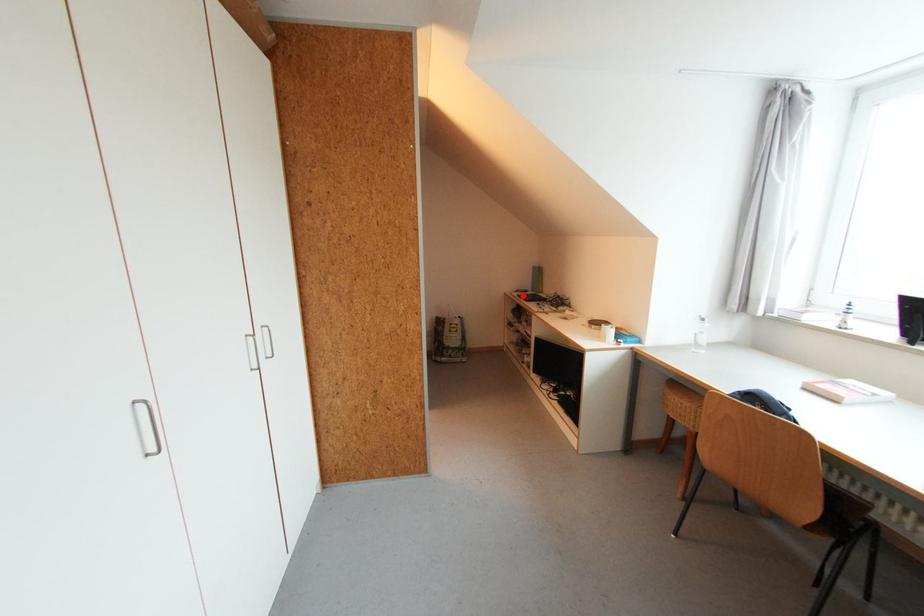
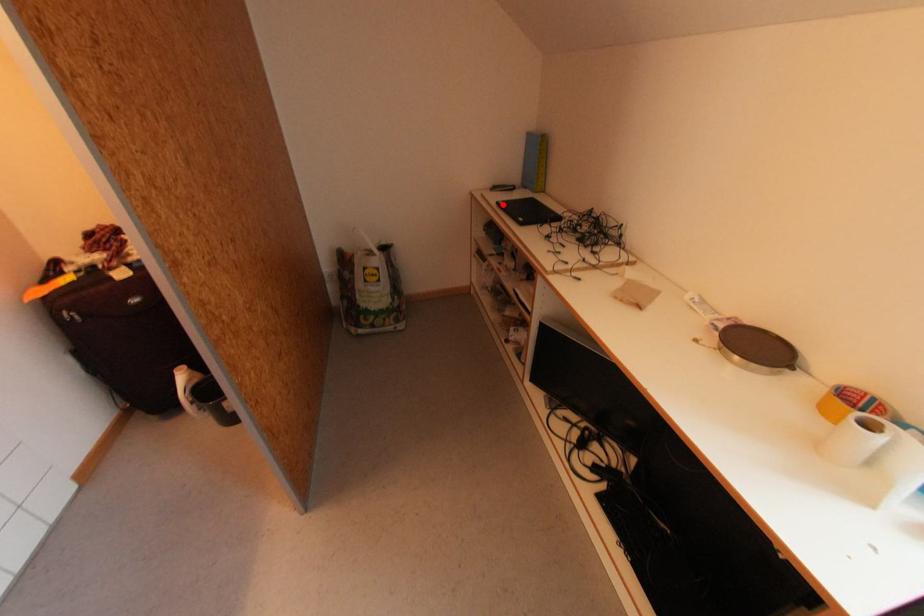
I am providing you with two images of the same scene from different viewpoints. A red point is marked on the first image and another point is marked on the second image. Are the points marked in image1 and image2 representing the same 3D position?

Yes